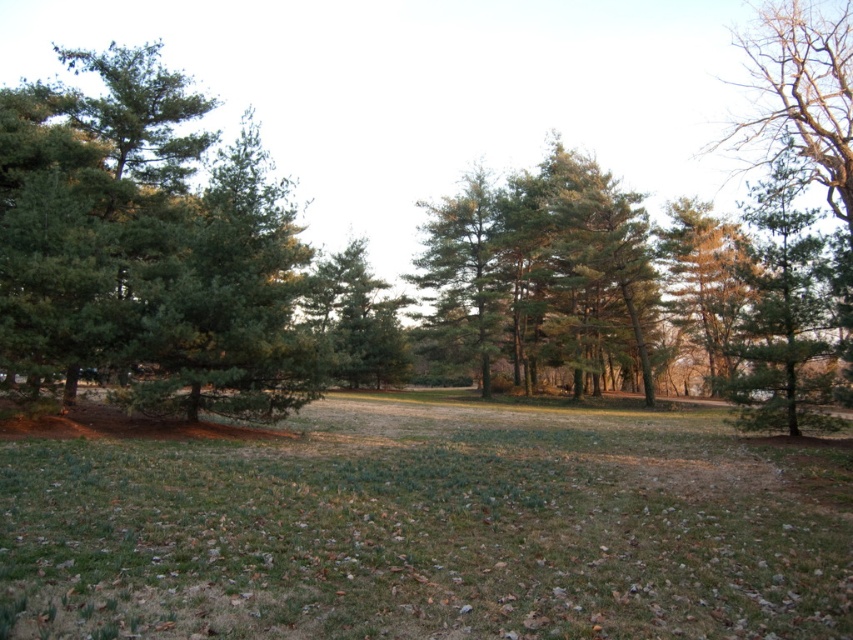
Is green grass at center to the right of green matte tree at right from the viewer's perspective?

Incorrect, green grass at center is not on the right side of green matte tree at right.

Is green grass at center thinner than green matte tree at right?

Incorrect, green grass at center's width is not less than green matte tree at right's.

Identify the location of green grass at center. The image size is (853, 640). (421, 531).

Between green needle-like tree at left and green matte tree at center, which one appears on the right side from the viewer's perspective?

From the viewer's perspective, green matte tree at center appears more on the right side.

Measure the distance between green needle-like tree at left and camera.

green needle-like tree at left and camera are 13.42 meters apart from each other.

Locate an element on the screen. green needle-like tree at left is located at coordinates (148, 248).

Which is behind, point (247, 243) or point (814, 291)?

Point (814, 291)

Is green needle-like tree at left further to the viewer compared to green matte tree at right?

No, it is in front of green matte tree at right.

This screenshot has height=640, width=853. I want to click on green needle-like tree at left, so click(148, 248).

In order to click on green needle-like tree at left in this screenshot , I will do `click(148, 248)`.